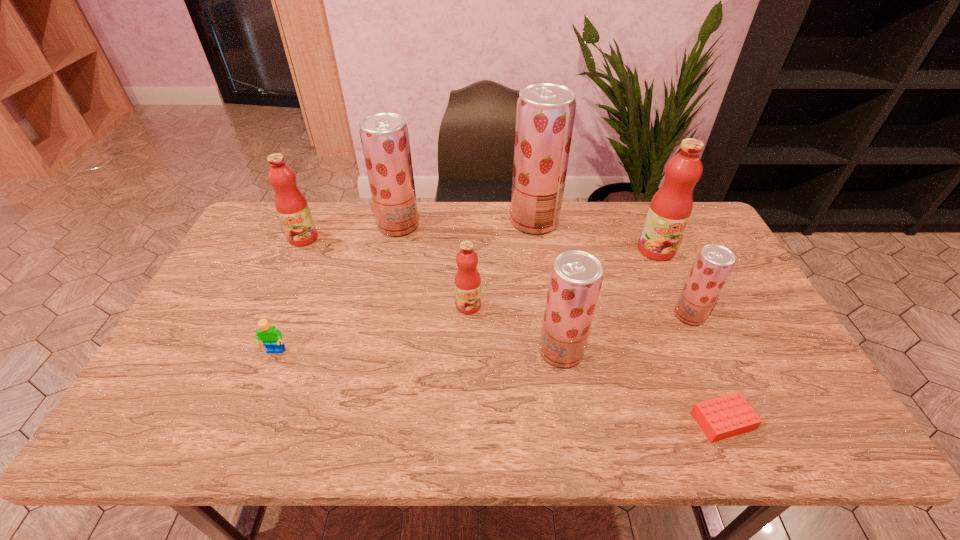
At what (x,y) coordinates should I click in order to perform the action: click on the biggest strawberry fruit juice. Please return your answer as a coordinate pair (x, y). The height and width of the screenshot is (540, 960). Looking at the image, I should click on (545, 115).

Find the location of a particular element. The height and width of the screenshot is (540, 960). the tallest fruit juice is located at coordinates (x=545, y=115).

What are the coordinates of `the biggest pink fruit juice` in the screenshot? It's located at (670, 208).

The image size is (960, 540). I want to click on the leftmost strawberry fruit juice, so click(x=384, y=136).

The width and height of the screenshot is (960, 540). What are the coordinates of `the third smallest strawberry fruit juice` in the screenshot? It's located at (384, 136).

The width and height of the screenshot is (960, 540). Find the location of `the second smallest pink fruit juice`. the second smallest pink fruit juice is located at coordinates (292, 207).

Where is `the leftmost pink fruit juice`? The width and height of the screenshot is (960, 540). the leftmost pink fruit juice is located at coordinates (292, 207).

Locate an element on the screen. The width and height of the screenshot is (960, 540). the nearest strawberry fruit juice is located at coordinates (576, 276).

Where is `the third biggest strawberry fruit juice`? The height and width of the screenshot is (540, 960). the third biggest strawberry fruit juice is located at coordinates (576, 276).

At what (x,y) coordinates should I click in order to perform the action: click on the rightmost strawberry fruit juice. Please return your answer as a coordinate pair (x, y). This screenshot has height=540, width=960. Looking at the image, I should click on (714, 263).